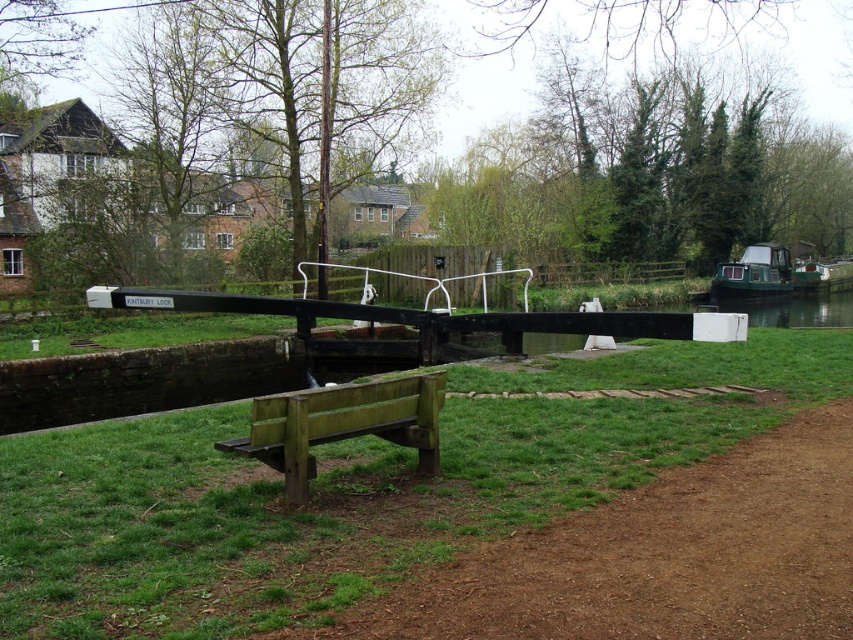
Who is more distant from viewer, (558, 547) or (372, 420)?

Point (372, 420)

Is brown dirt path at lower right behind green weathered wood bench at lower center?

No, brown dirt path at lower right is in front of green weathered wood bench at lower center.

Between point (576, 577) and point (366, 428), which one is positioned behind?

Point (366, 428)

You are a GUI agent. You are given a task and a screenshot of the screen. Output one action in this format:
    pyautogui.click(x=<x>, y=<y>)
    Task: Click on the brown dirt path at lower right
    The image size is (853, 640).
    Given the screenshot: What is the action you would take?
    pyautogui.click(x=662, y=556)

Who is positioned more to the left, brown dirt path at lower right or green matte boat at right?

Positioned to the left is brown dirt path at lower right.

Between point (741, 588) and point (743, 285), which one is positioned behind?

The point (743, 285) is behind.

Find the location of `brown dirt path at lower right`. brown dirt path at lower right is located at coordinates (662, 556).

Can you confirm if green weathered wood bench at lower center is wider than green matte boat at right?

Incorrect, green weathered wood bench at lower center's width does not surpass green matte boat at right's.

Where is `green weathered wood bench at lower center`? green weathered wood bench at lower center is located at coordinates (341, 424).

Which is in front, point (339, 396) or point (718, 272)?

Point (339, 396)

Identify the location of green weathered wood bench at lower center. This screenshot has width=853, height=640. click(x=341, y=424).